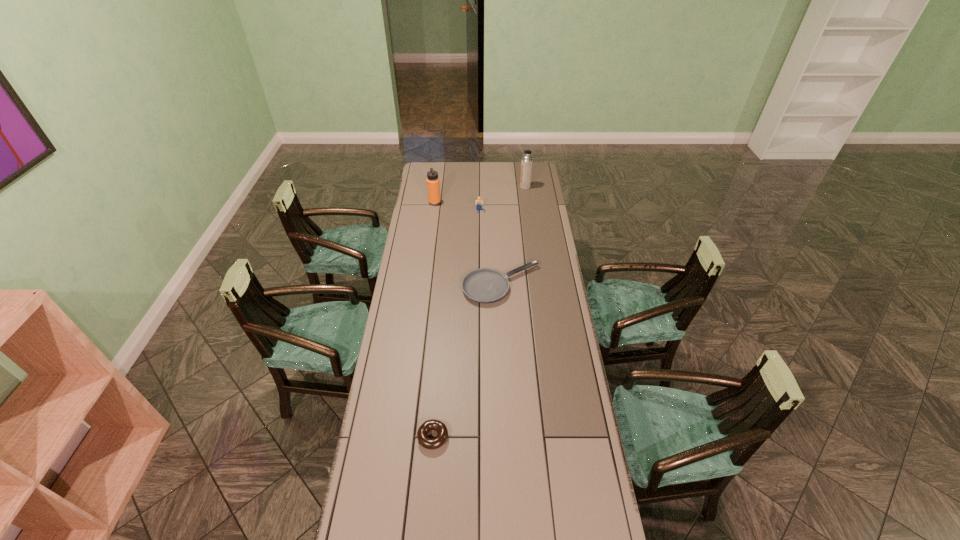
Where is `vacant area between the farther thermos bottle and the fourth nearest object`? This screenshot has width=960, height=540. vacant area between the farther thermos bottle and the fourth nearest object is located at coordinates (480, 194).

Locate an element on the screen. This screenshot has width=960, height=540. free space that is in between the fourth farthest object and the right thermos bottle is located at coordinates (514, 235).

The height and width of the screenshot is (540, 960). What are the coordinates of `free spot between the leftmost object and the frying pan` in the screenshot? It's located at (468, 244).

At what (x,y) coordinates should I click in order to perform the action: click on empty location between the leftmost object and the doughnut. Please return your answer as a coordinate pair (x, y). This screenshot has width=960, height=540. Looking at the image, I should click on (434, 320).

This screenshot has width=960, height=540. I want to click on free spot between the frying pan and the Lego, so click(x=491, y=247).

The width and height of the screenshot is (960, 540). I want to click on free space between the fourth farthest object and the nearest object, so click(468, 361).

Locate an element on the screen. Image resolution: width=960 pixels, height=540 pixels. object that stands as the closest to the third nearest object is located at coordinates (433, 185).

Where is `object that is the closest to the frying pan`? The width and height of the screenshot is (960, 540). object that is the closest to the frying pan is located at coordinates (478, 203).

I want to click on free space that satisfies the following two spatial constraints: 1. on the face of the frying pan; 2. on the left side of the third tallest object, so click(x=479, y=284).

The image size is (960, 540). In order to click on blank space that satisfies the following two spatial constraints: 1. on the back side of the farther thermos bottle; 2. on the left side of the second farthest object in this screenshot , I will do `click(437, 186)`.